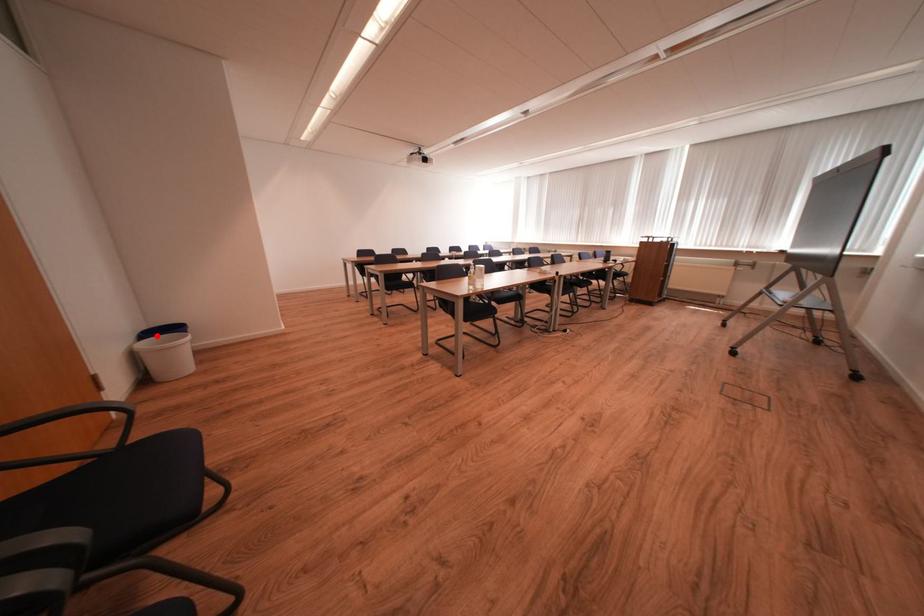
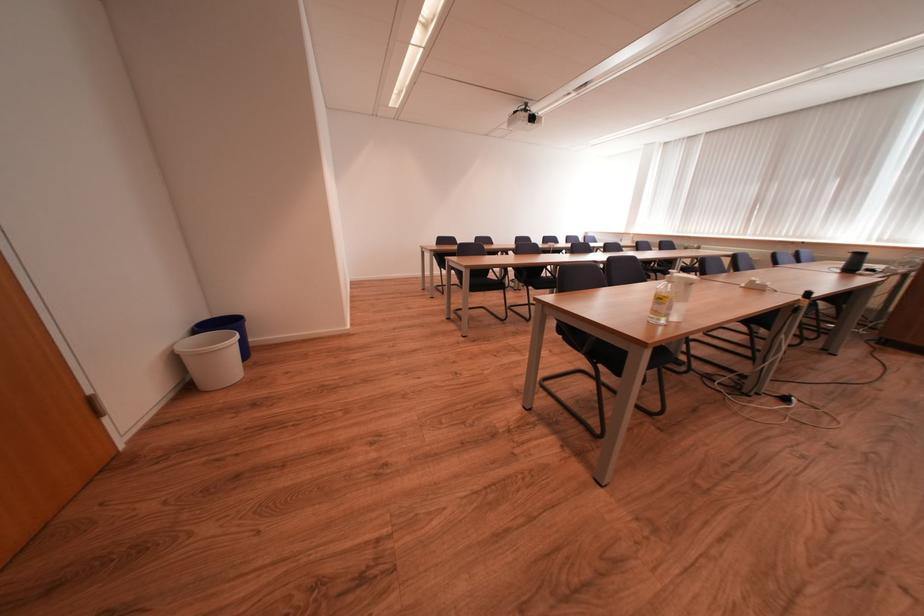
Locate, in the second image, the point that corresponds to the highlighted location in the first image.

(213, 329)